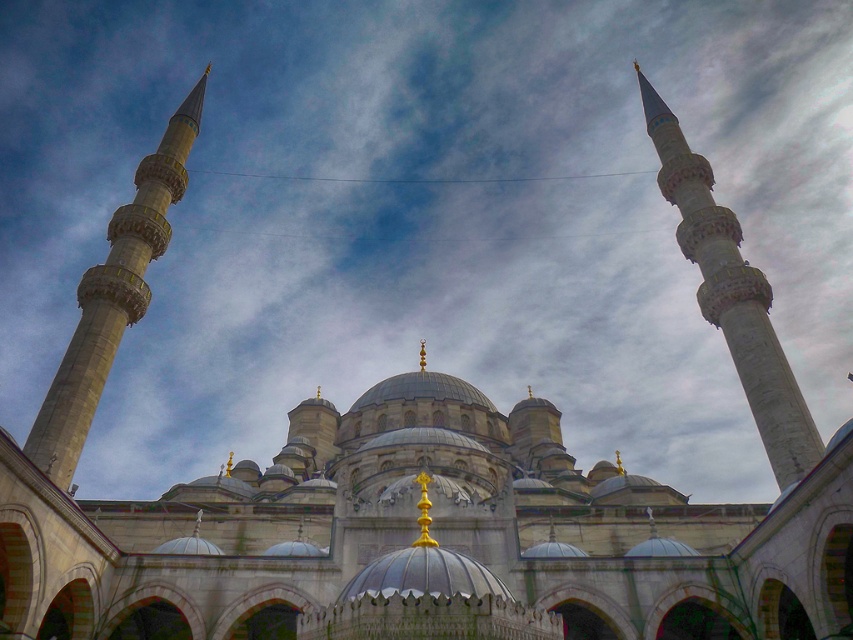
Which of these two, white marble minaret at upper right or gray stone minaret at left, stands shorter?

With less height is gray stone minaret at left.

Between point (744, 328) and point (146, 259), which one is positioned behind?

Positioned behind is point (146, 259).

At what (x,y) coordinates should I click in order to perform the action: click on white marble minaret at upper right. Please return your answer as a coordinate pair (x, y). Looking at the image, I should click on (732, 296).